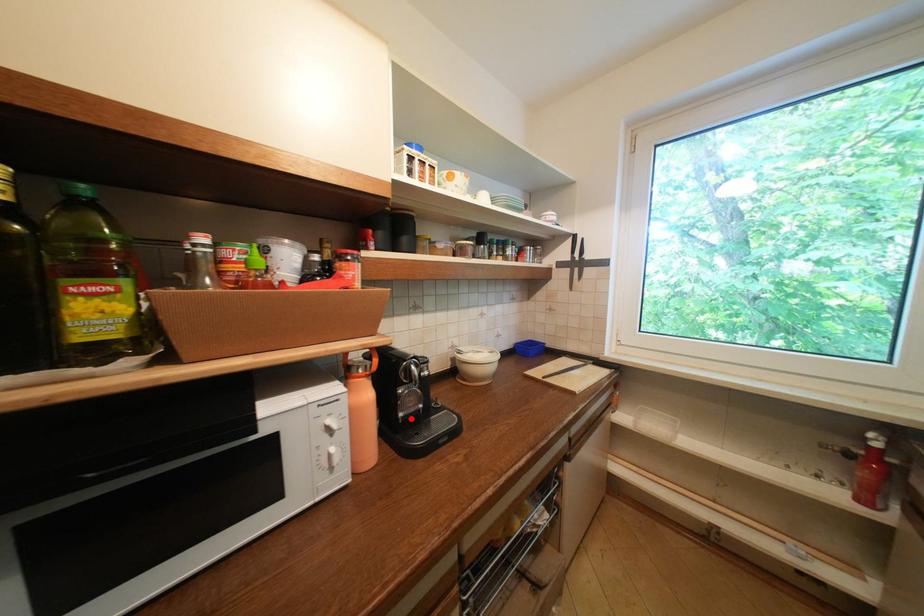
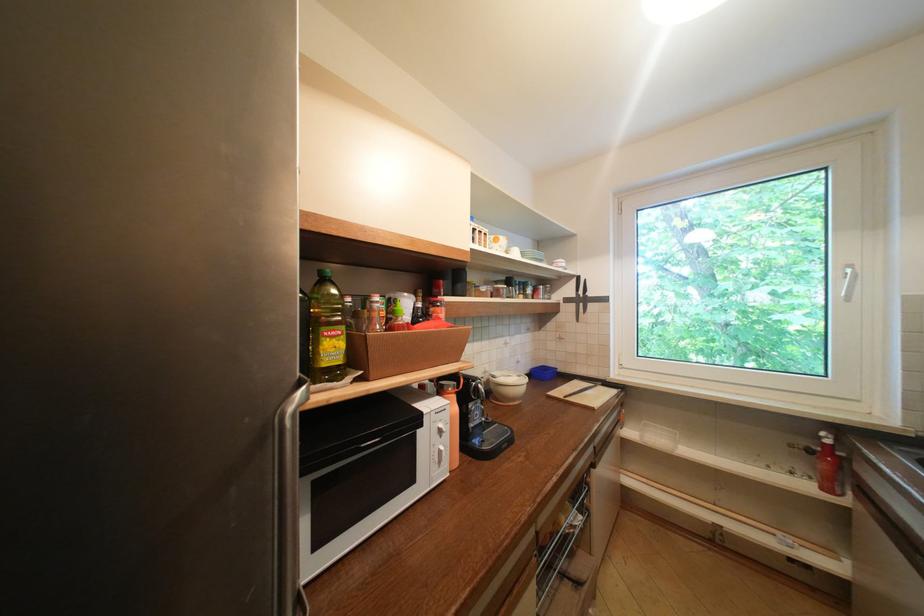
Where in the second image is the point corresponding to the highlighted location from the first image?

(481, 429)